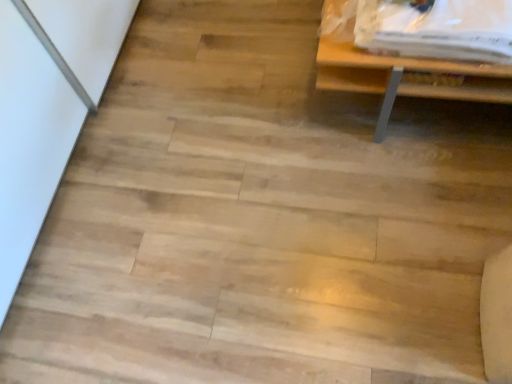
What do you see at coordinates (419, 47) in the screenshot? I see `wooden table at upper right` at bounding box center [419, 47].

Find the location of a particular element. The image size is (512, 384). wooden table at upper right is located at coordinates (419, 47).

Measure the distance between point (437,29) and camera.

Point (437,29) and camera are 3.83 feet apart from each other.

Find the location of a particular element. This screenshot has width=512, height=384. wooden table at upper right is located at coordinates (419, 47).